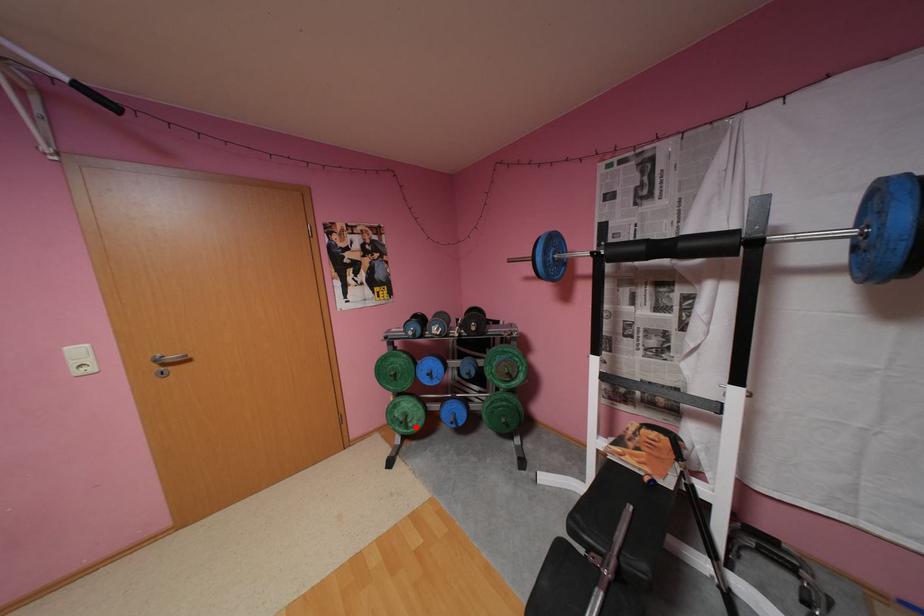
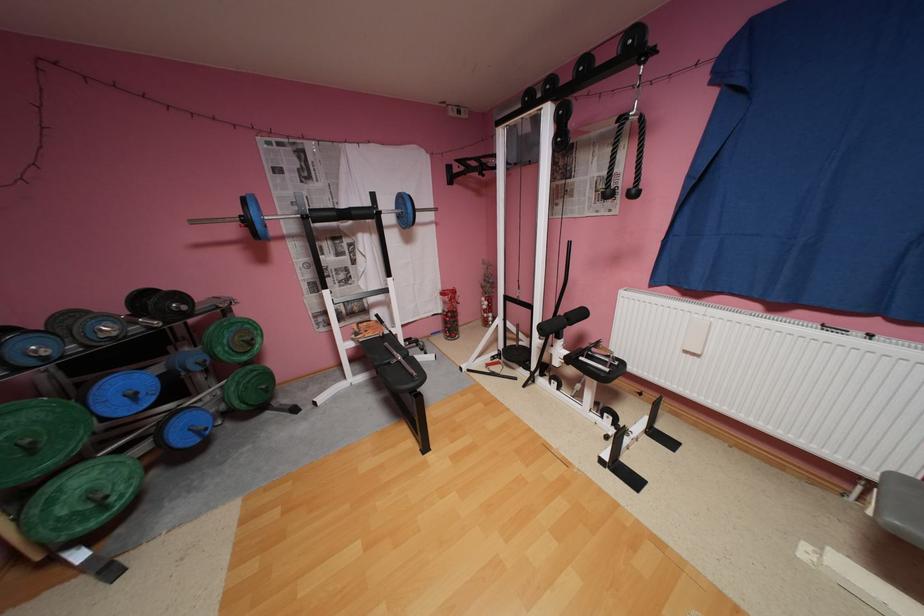
Locate, in the second image, the point that corresponds to the highlighted location in the first image.

(116, 508)